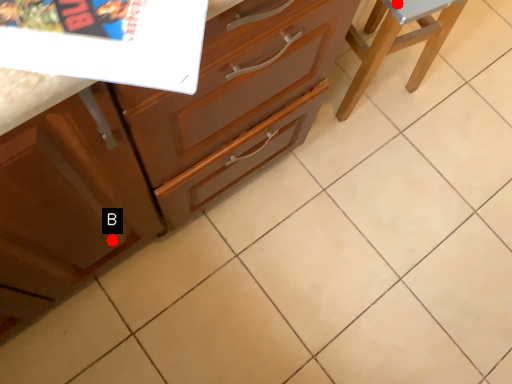
Question: Two points are circled on the image, labeled by A and B beside each circle. Which of the following is the closest to the observer?

Choices:
 (A) A is closer
 (B) B is closer

Answer: (B)